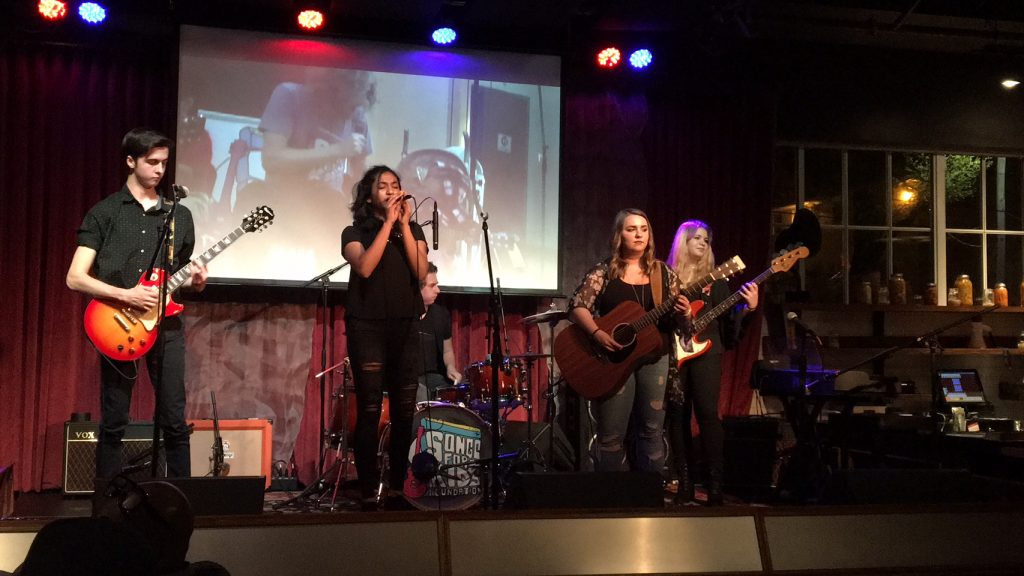
The width and height of the screenshot is (1024, 576). I want to click on curtains, so click(31, 338).